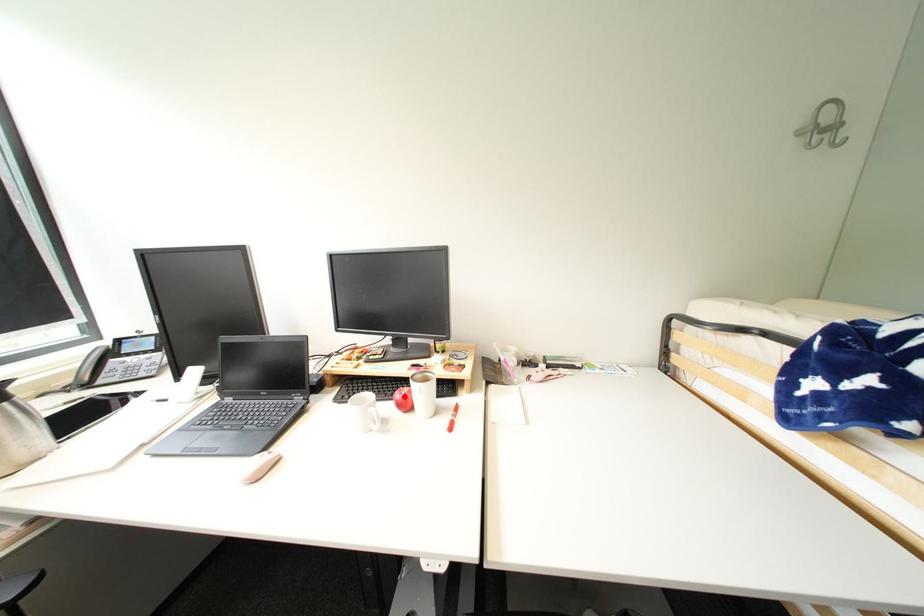
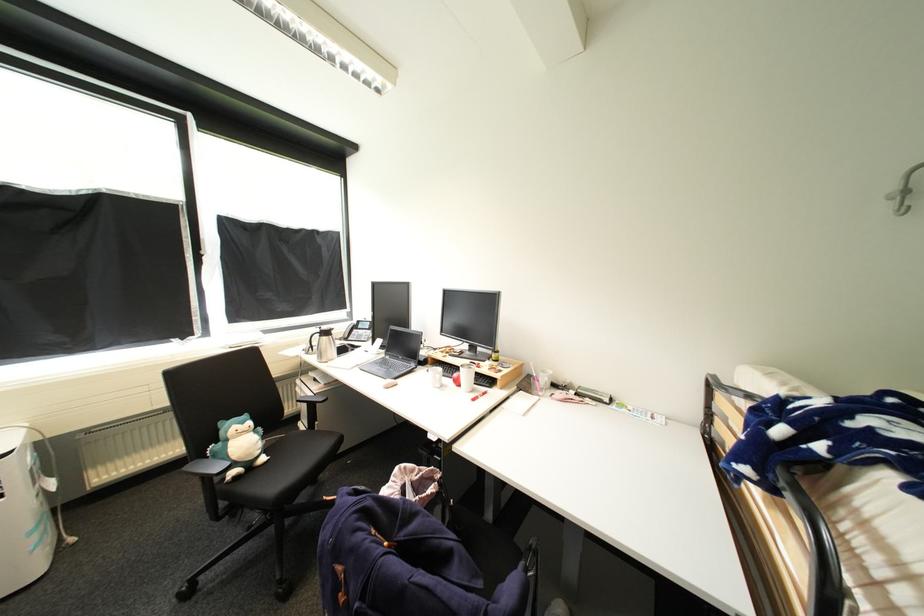
In the second image, find the point that corresponds to the highlighted location in the first image.

(462, 376)